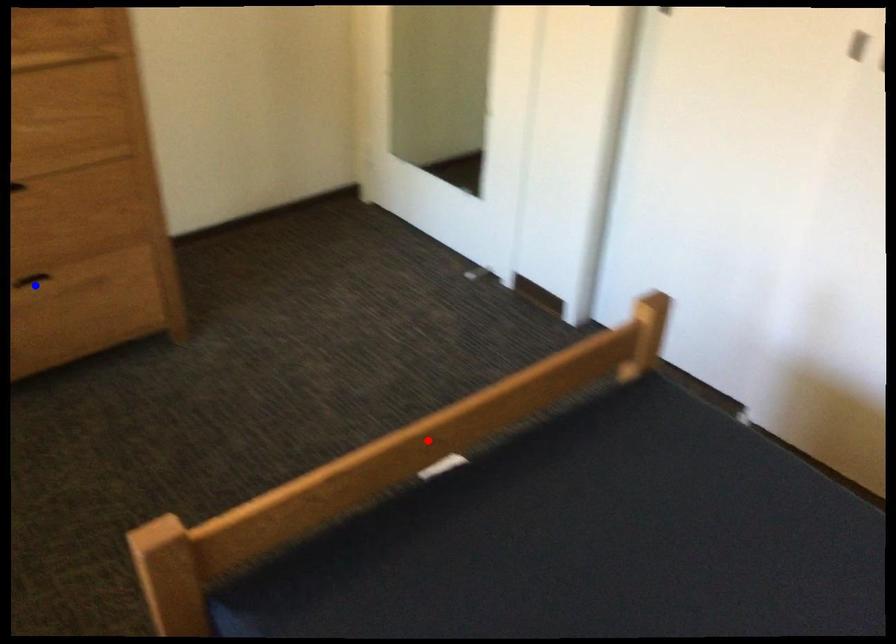
Question: Two points are marked on the image. Which point is closer to the camera?

Choices:
 (A) Blue point is closer.
 (B) Red point is closer.

Answer: (B)